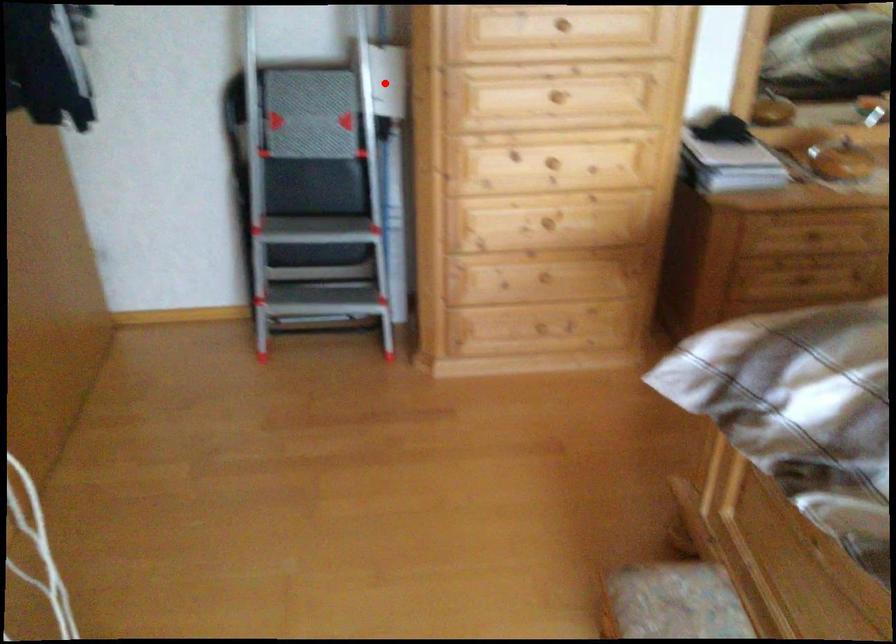
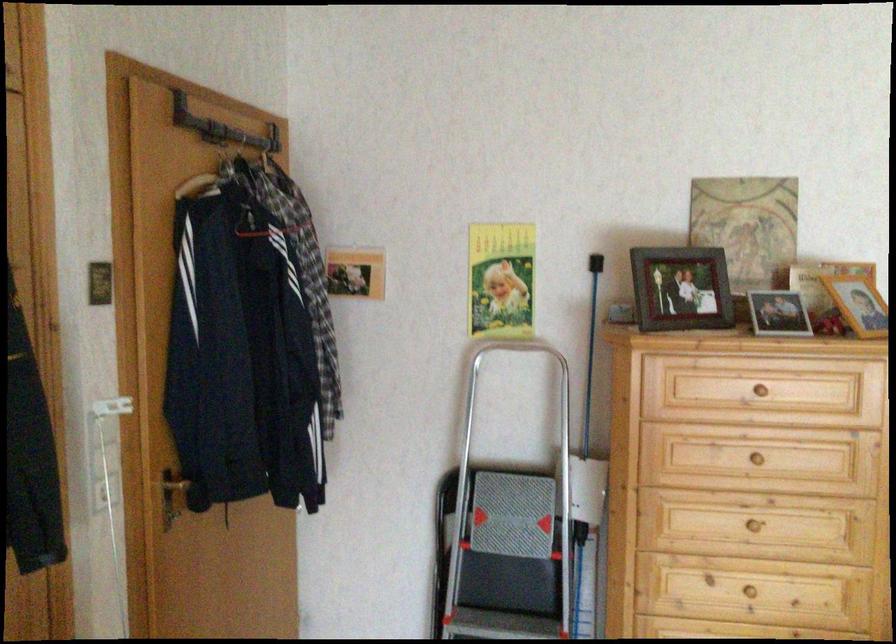
Where in the second image is the point corresponding to the highlighted location from the first image?

(588, 489)